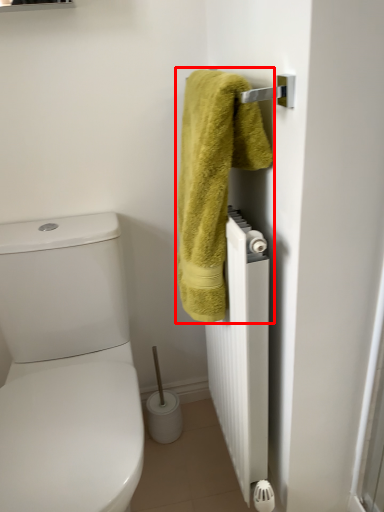
Question: From the image's perspective, what is the correct spatial relationship of towel (annotated by the red box) in relation to radiator?

Choices:
 (A) below
 (B) above

Answer: (B)